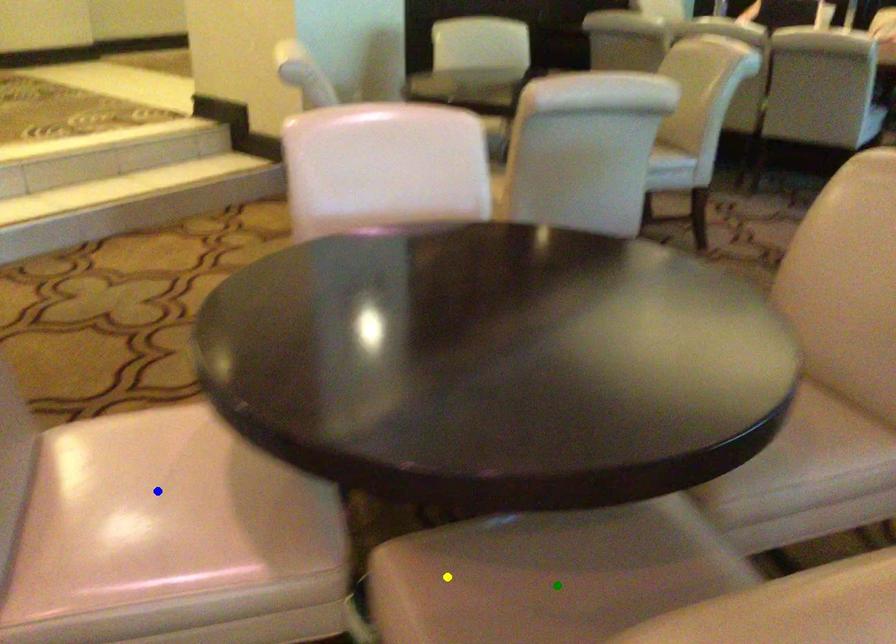
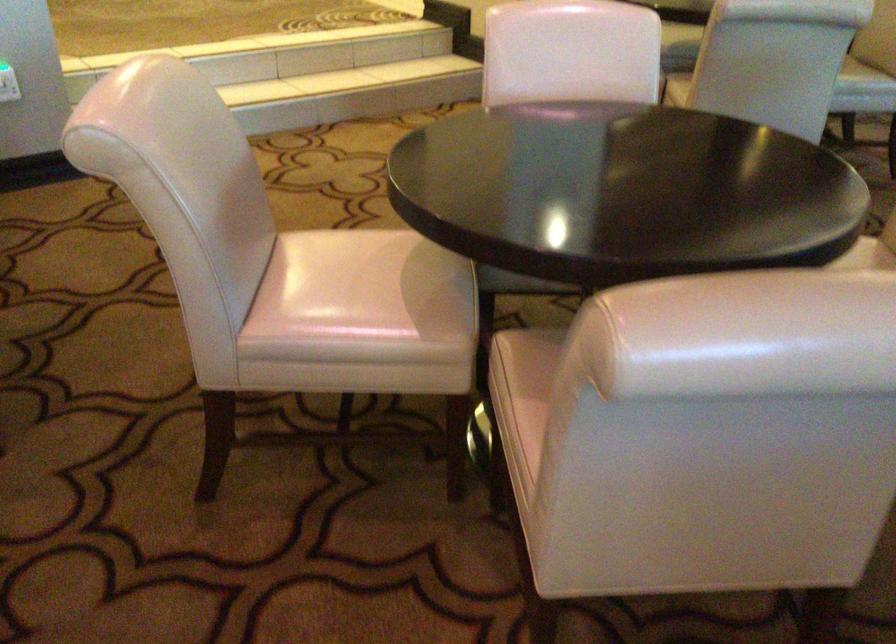
I am providing you with two images of the same scene from different viewpoints. Three points are marked in image1. Which point corresponds to a part or object that is occluded in image2?In image1, three points are marked. Which of them correspond to a part or object that is occluded in image2?Among the three points shown in image1, which one corresponds to a part or object that is no longer visible due to occlusion in image2?

green point cannot be seen in image2.